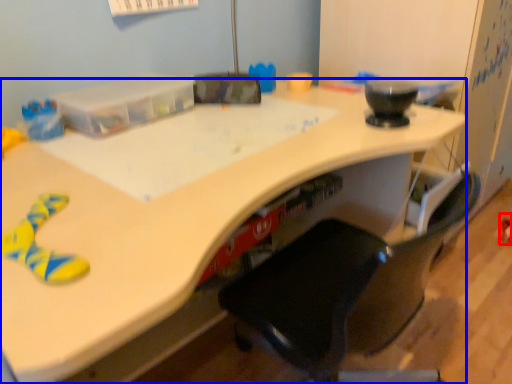
Question: Among these objects, which one is nearest to the camera, toy (highlighted by a red box) or desk (highlighted by a blue box)?

Choices:
 (A) toy
 (B) desk

Answer: (B)